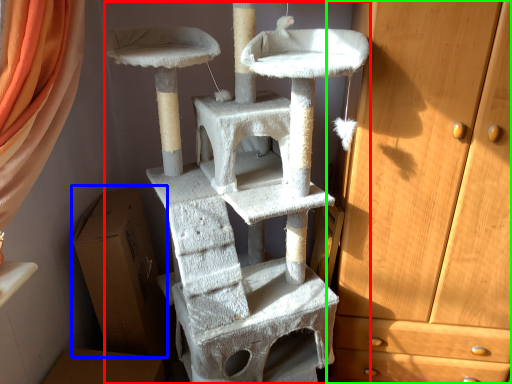
Question: Which object is the farthest from bunk bed (highlighted by a red box)? Choose among these: cardboard box (highlighted by a blue box) or chest of drawers (highlighted by a green box).

Choices:
 (A) cardboard box
 (B) chest of drawers

Answer: (A)